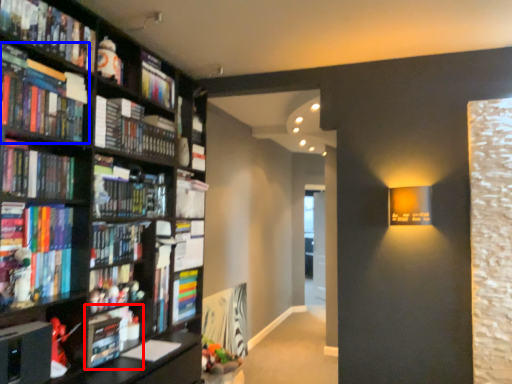
Question: Which object appears closest to the camera in this image, book (highlighted by a red box) or book (highlighted by a blue box)?

Choices:
 (A) book
 (B) book

Answer: (B)